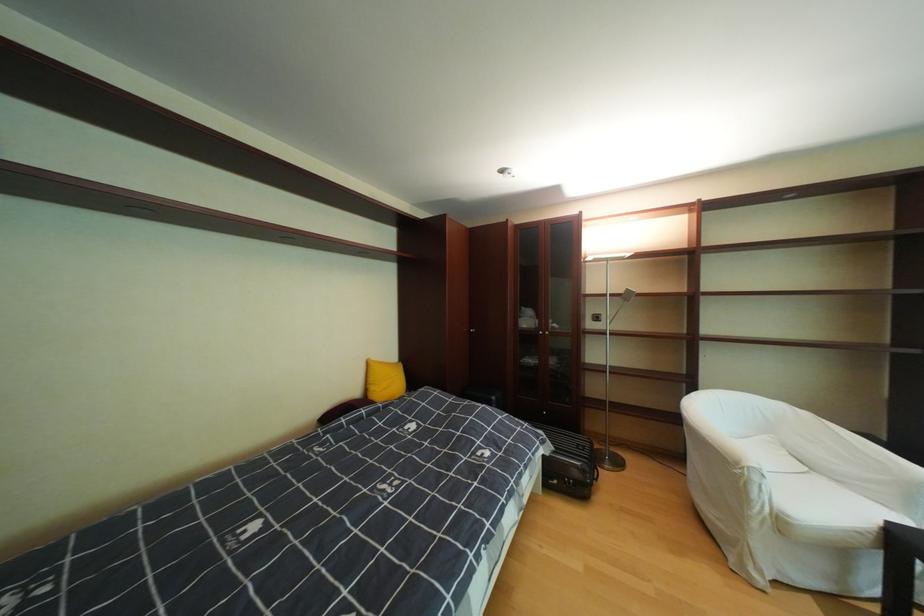
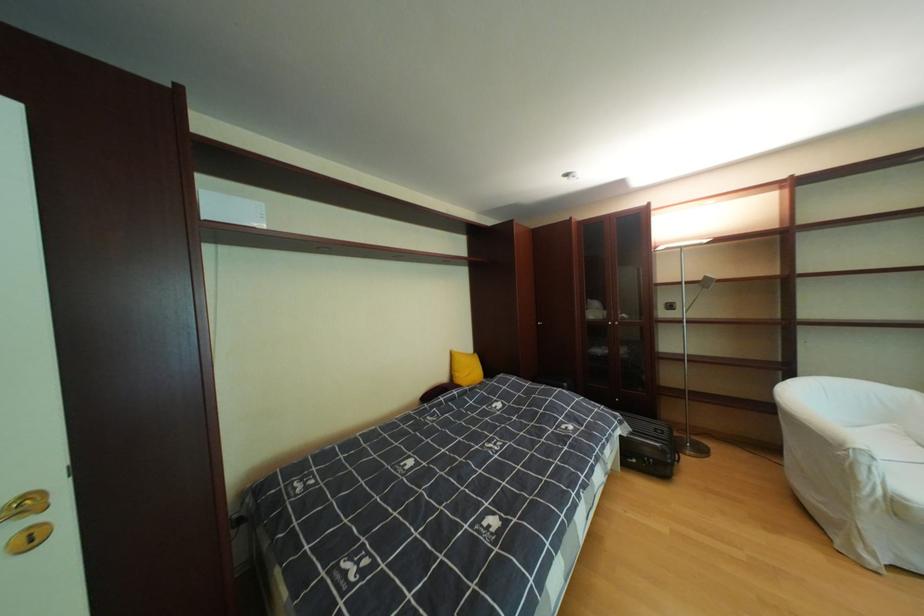
Locate, in the second image, the point that corresponds to the point at 624,296 in the first image.

(699, 284)